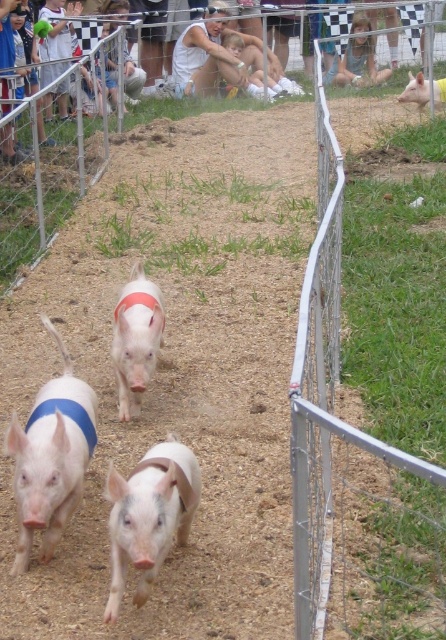
Question: Can you confirm if white matte pig at center is thinner than pink smooth pig at upper right?

Choices:
 (A) no
 (B) yes

Answer: (B)

Question: Where is pink fabric pig at center located in relation to pink smooth pig at upper right in the image?

Choices:
 (A) right
 (B) left

Answer: (B)

Question: Considering the real-world distances, which object is farthest from the pink smooth pig at upper right?

Choices:
 (A) white matte pig at center
 (B) pink smooth pig at center
 (C) pink fabric pig at center

Answer: (B)

Question: Does pink smooth pig at center appear on the left side of pink smooth pig at upper right?

Choices:
 (A) no
 (B) yes

Answer: (B)

Question: Which object is positioned farthest from the pink smooth pig at upper right?

Choices:
 (A) pink smooth pig at center
 (B) pink fabric pig at center

Answer: (A)

Question: Which of the following is the farthest from the observer?

Choices:
 (A) (184, 524)
 (B) (71, 372)
 (C) (147, 346)
 (D) (417, 92)

Answer: (D)